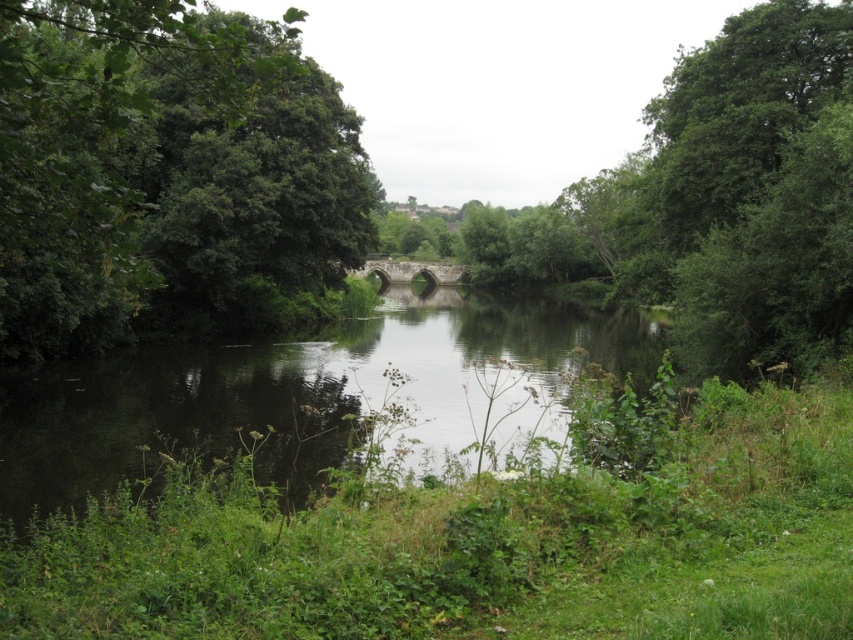
You are a hiker standing on the stone bridge and want to take a photo of the green leafy tree at left and the dark reflective water at center. Which object should you point your camera towards first if you want to capture both in one frame?

You should point your camera towards the green leafy tree at left first since it is to the left of the dark reflective water at center, allowing both to be captured in the frame by positioning the tree on the left side and the water at the center.

You are a bird flying over the serene natural scene. You see the green leafy tree at left and the dark reflective water at center. Which object is positioned higher in the image?

The green leafy tree at left is located above dark reflective water at center, so it is positioned higher in the image.

You are standing at the center of the stone bridge in the midground. You see a point marked at coordinates point (x=167, y=176). Which object in the scene does this point belong to?

The point (x=167, y=176) is on the green leafy tree at left.